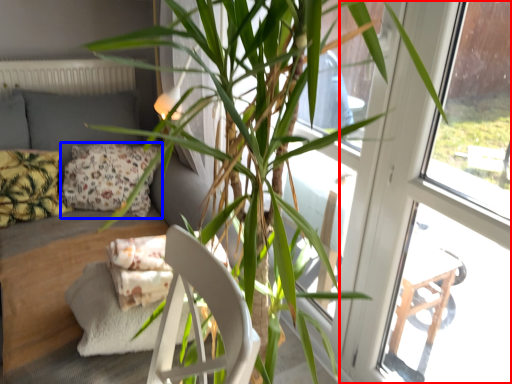
Question: Which point is further to the camera, screen door (highlighted by a red box) or pillow (highlighted by a blue box)?

Choices:
 (A) screen door
 (B) pillow

Answer: (B)